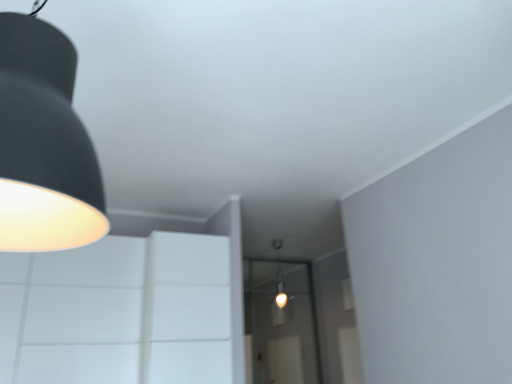
What is the approximate width of transparent glass door at center?

It is 4.45 inches.

Locate an element on the screen. transparent glass door at center is located at coordinates (280, 324).

The height and width of the screenshot is (384, 512). What do you see at coordinates (280, 324) in the screenshot? I see `transparent glass door at center` at bounding box center [280, 324].

The width and height of the screenshot is (512, 384). What do you see at coordinates (44, 144) in the screenshot? I see `matte black lampshade at upper left` at bounding box center [44, 144].

Where is `matte black lampshade at upper left`? This screenshot has width=512, height=384. matte black lampshade at upper left is located at coordinates (44, 144).

What is the approximate height of matte black lampshade at upper left?

matte black lampshade at upper left is 37.70 inches tall.

At what (x,y) coordinates should I click in order to perform the action: click on transparent glass door at center. Please return your answer as a coordinate pair (x, y). This screenshot has height=384, width=512. Looking at the image, I should click on (280, 324).

Is matte black lampshade at upper left at the left side of transparent glass door at center?

Indeed, matte black lampshade at upper left is positioned on the left side of transparent glass door at center.

Is matte black lampshade at upper left further to camera compared to transparent glass door at center?

No, the depth of matte black lampshade at upper left is less than that of transparent glass door at center.

Is point (67, 59) positioned behind point (250, 374)?

No, it is in front of (250, 374).

From the image's perspective, is matte black lampshade at upper left located above or below transparent glass door at center?

matte black lampshade at upper left is above transparent glass door at center.

From a real-world perspective, is matte black lampshade at upper left physically above transparent glass door at center?

Yes, from a real-world perspective, matte black lampshade at upper left is on top of transparent glass door at center.

Between matte black lampshade at upper left and transparent glass door at center, which one has smaller width?

transparent glass door at center.

Who is taller, matte black lampshade at upper left or transparent glass door at center?

With more height is transparent glass door at center.

Considering the relative sizes of matte black lampshade at upper left and transparent glass door at center in the image provided, is matte black lampshade at upper left smaller than transparent glass door at center?

Indeed, matte black lampshade at upper left has a smaller size compared to transparent glass door at center.

From the picture: Can we say matte black lampshade at upper left lies outside transparent glass door at center?

Indeed, matte black lampshade at upper left is completely outside transparent glass door at center.

Are matte black lampshade at upper left and transparent glass door at center located far from each other?

Yes, matte black lampshade at upper left is far from transparent glass door at center.

Consider the image. Could you tell me if matte black lampshade at upper left is facing transparent glass door at center?

No, matte black lampshade at upper left does not turn towards transparent glass door at center.

Can you tell me how much matte black lampshade at upper left and transparent glass door at center differ in facing direction?

They differ by 87.7 degrees in their facing directions.

Identify the location of lamp that appears above the transparent glass door at center (from the image's perspective). The image size is (512, 384). (44, 144).

Does transparent glass door at center appear on the left side of matte black lampshade at upper left?

No, transparent glass door at center is not to the left of matte black lampshade at upper left.

Which object is further away from the camera taking this photo, transparent glass door at center or matte black lampshade at upper left?

transparent glass door at center is more distant.

Does point (304, 281) lie behind point (72, 196)?

Yes.

Based on the photo, from the image's perspective, relative to matte black lampshade at upper left, is transparent glass door at center above or below?

transparent glass door at center is situated lower than matte black lampshade at upper left in the image.

From a real-world perspective, between transparent glass door at center and matte black lampshade at upper left, who is vertically lower?

From a 3D spatial view, transparent glass door at center is below.

Does transparent glass door at center have a lesser width compared to matte black lampshade at upper left?

Indeed, transparent glass door at center has a lesser width compared to matte black lampshade at upper left.

Does transparent glass door at center have a greater height compared to matte black lampshade at upper left?

Yes.

Can you confirm if transparent glass door at center is smaller than matte black lampshade at upper left?

Actually, transparent glass door at center might be larger than matte black lampshade at upper left.

Is transparent glass door at center not inside matte black lampshade at upper left?

Yes, transparent glass door at center is outside of matte black lampshade at upper left.

Is transparent glass door at center beside matte black lampshade at upper left?

No.

Is transparent glass door at center turned away from matte black lampshade at upper left?

No, transparent glass door at center's orientation is not away from matte black lampshade at upper left.

What's the angular difference between transparent glass door at center and matte black lampshade at upper left's facing directions?

transparent glass door at center and matte black lampshade at upper left are facing 87.7 degrees away from each other.

How much distance is there between transparent glass door at center and matte black lampshade at upper left?

transparent glass door at center is 4.91 meters away from matte black lampshade at upper left.

The height and width of the screenshot is (384, 512). What are the coordinates of `glass door below the matte black lampshade at upper left (from the image's perspective)` in the screenshot? It's located at (280, 324).

The image size is (512, 384). Identify the location of glass door on the right of matte black lampshade at upper left. (280, 324).

The height and width of the screenshot is (384, 512). Identify the location of glass door that is under the matte black lampshade at upper left (from a real-world perspective). (280, 324).